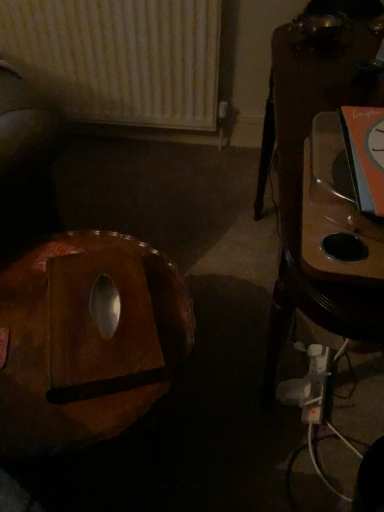
Question: Is wooden table at right aimed at brown leather bean bag chair at lower left?

Choices:
 (A) yes
 (B) no

Answer: (A)

Question: Considering the relative sizes of wooden table at right and brown leather bean bag chair at lower left in the image provided, is wooden table at right bigger than brown leather bean bag chair at lower left?

Choices:
 (A) yes
 (B) no

Answer: (A)

Question: From the image's perspective, is wooden table at right beneath brown leather bean bag chair at lower left?

Choices:
 (A) no
 (B) yes

Answer: (A)

Question: Can you confirm if wooden table at right is shorter than brown leather bean bag chair at lower left?

Choices:
 (A) no
 (B) yes

Answer: (A)

Question: Is wooden table at right not close to brown leather bean bag chair at lower left?

Choices:
 (A) yes
 (B) no

Answer: (B)

Question: Considering the positions of white textured radiator at upper left and wooden table at right in the image, is white textured radiator at upper left wider or thinner than wooden table at right?

Choices:
 (A) thin
 (B) wide

Answer: (A)

Question: From their relative heights in the image, would you say white textured radiator at upper left is taller or shorter than wooden table at right?

Choices:
 (A) tall
 (B) short

Answer: (B)

Question: From the image's perspective, is white textured radiator at upper left located above or below wooden table at right?

Choices:
 (A) above
 (B) below

Answer: (A)

Question: Visually, is white textured radiator at upper left positioned to the left or to the right of wooden table at right?

Choices:
 (A) left
 (B) right

Answer: (A)

Question: Looking at their shapes, would you say white textured radiator at upper left is wider or thinner than brown leather bean bag chair at lower left?

Choices:
 (A) thin
 (B) wide

Answer: (A)

Question: Is white textured radiator at upper left taller or shorter than brown leather bean bag chair at lower left?

Choices:
 (A) short
 (B) tall

Answer: (B)

Question: Considering the positions of point (26, 32) and point (3, 369), is point (26, 32) closer or farther from the camera than point (3, 369)?

Choices:
 (A) farther
 (B) closer

Answer: (A)

Question: In the image, is white textured radiator at upper left positioned in front of or behind brown leather bean bag chair at lower left?

Choices:
 (A) behind
 (B) front

Answer: (A)

Question: Considering the positions of point (359, 79) and point (122, 311), is point (359, 79) closer or farther from the camera than point (122, 311)?

Choices:
 (A) closer
 (B) farther

Answer: (B)

Question: Considering the positions of wooden table at right and brown leather bean bag chair at lower left in the image, is wooden table at right wider or thinner than brown leather bean bag chair at lower left?

Choices:
 (A) thin
 (B) wide

Answer: (A)